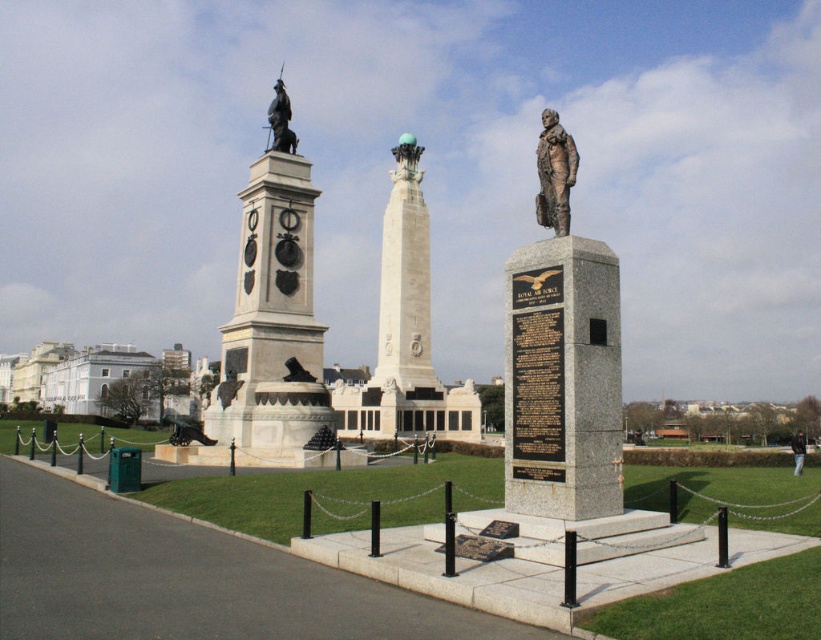
Does point (425, 388) come farther from viewer compared to point (268, 106)?

No, it is not.

Does white marble tower at center come behind bronze statue at upper center?

No, white marble tower at center is closer to the viewer.

Is point (456, 400) less distant than point (281, 81)?

No.

The height and width of the screenshot is (640, 821). I want to click on white marble tower at center, so click(x=406, y=332).

Between point (555, 147) and point (283, 147), which one is positioned in front?

Positioned in front is point (555, 147).

Between bronze statue at center and bronze statue at upper center, which one has less height?

bronze statue at center is shorter.

This screenshot has height=640, width=821. Describe the element at coordinates (553, 173) in the screenshot. I see `bronze statue at center` at that location.

Where is `bronze statue at center`? The image size is (821, 640). bronze statue at center is located at coordinates (553, 173).

Is white marble tower at center bigger than bronze statue at center?

Yes.

Can you confirm if white marble tower at center is smaller than bronze statue at center?

Incorrect, white marble tower at center is not smaller in size than bronze statue at center.

Is point (402, 422) positioned in front of point (569, 154)?

No, (402, 422) is behind (569, 154).

The width and height of the screenshot is (821, 640). In order to click on white marble tower at center in this screenshot , I will do `click(406, 332)`.